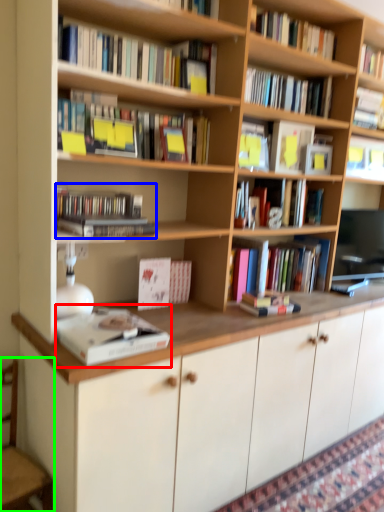
Question: Considering the real-world distances, which object is farthest from book (highlighted by a red box)? book (highlighted by a blue box) or armchair (highlighted by a green box)?

Choices:
 (A) book
 (B) armchair

Answer: (B)